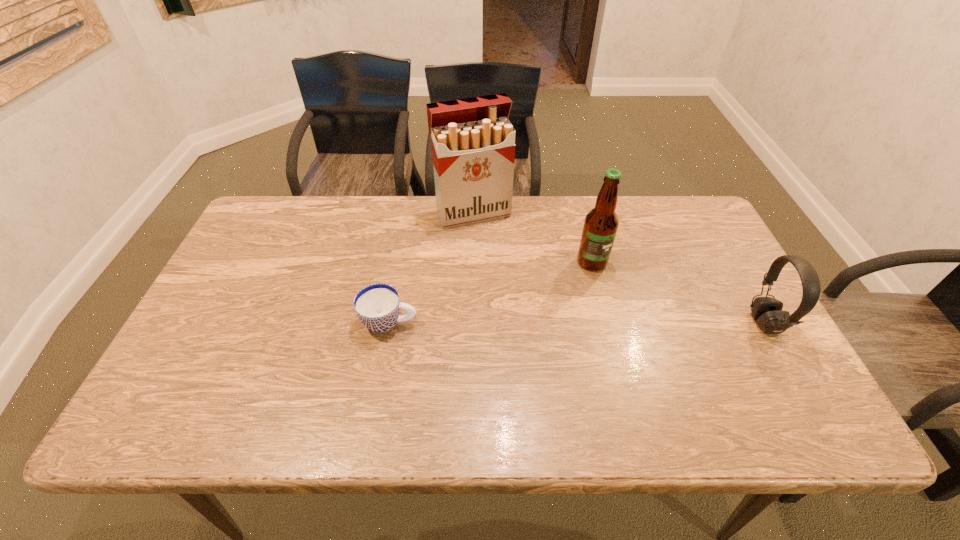
Where is `vacant space located on the front-facing side of the headset`? The height and width of the screenshot is (540, 960). vacant space located on the front-facing side of the headset is located at coordinates (637, 323).

Locate an element on the screen. This screenshot has width=960, height=540. free space located 0.300m on the front-facing side of the headset is located at coordinates (634, 323).

You are a GUI agent. You are given a task and a screenshot of the screen. Output one action in this format:
    pyautogui.click(x=<x>, y=<y>)
    Task: Click on the vacant space situated 0.390m on the label of the third object from left to right
    The image size is (960, 540).
    Given the screenshot: What is the action you would take?
    pyautogui.click(x=678, y=393)

Where is `vacant space located 0.350m on the label of the third object from left to right`? The height and width of the screenshot is (540, 960). vacant space located 0.350m on the label of the third object from left to right is located at coordinates (668, 377).

Locate an element on the screen. The height and width of the screenshot is (540, 960). vacant area located 0.140m on the label of the third object from left to right is located at coordinates (623, 309).

Identify the location of free space located with the lid open on the third object from right to left. Image resolution: width=960 pixels, height=540 pixels. (535, 327).

The width and height of the screenshot is (960, 540). In order to click on free spot located 0.200m with the lid open on the third object from right to left in this screenshot , I will do `click(507, 273)`.

Image resolution: width=960 pixels, height=540 pixels. Identify the location of free point located with the lid open on the third object from right to left. (492, 244).

Identify the location of object located at the far edge. This screenshot has width=960, height=540. (473, 142).

At what (x,y) coordinates should I click in order to perform the action: click on object that is at the right edge. Please return your answer as a coordinate pair (x, y). The height and width of the screenshot is (540, 960). Looking at the image, I should click on (767, 312).